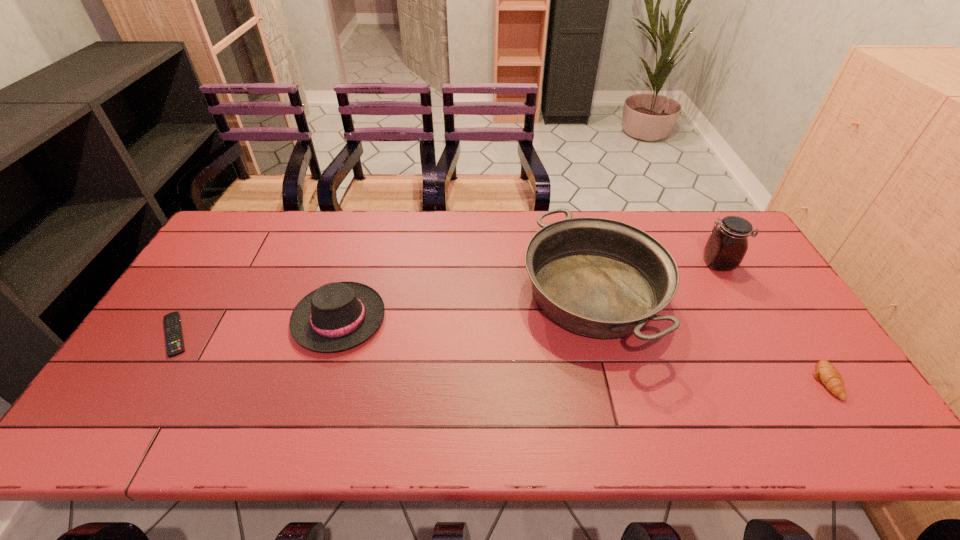
Image resolution: width=960 pixels, height=540 pixels. I want to click on jar, so click(x=727, y=245).

Image resolution: width=960 pixels, height=540 pixels. I want to click on the fourth shortest object, so click(597, 277).

The image size is (960, 540). Identify the location of pan. (597, 277).

Where is `the second object from left to right`? This screenshot has height=540, width=960. the second object from left to right is located at coordinates (337, 316).

Locate an element on the screen. This screenshot has width=960, height=540. the third tallest object is located at coordinates (337, 316).

Locate an element on the screen. This screenshot has width=960, height=540. crescent roll is located at coordinates (826, 373).

Find the location of a particular element. Image resolution: width=960 pixels, height=540 pixels. the second shortest object is located at coordinates (826, 373).

Locate an element on the screen. Image resolution: width=960 pixels, height=540 pixels. the shortest object is located at coordinates (172, 322).

Where is `the leftmost object`? the leftmost object is located at coordinates (172, 322).

I want to click on free space located 0.290m on the lid of the jar, so click(x=609, y=264).